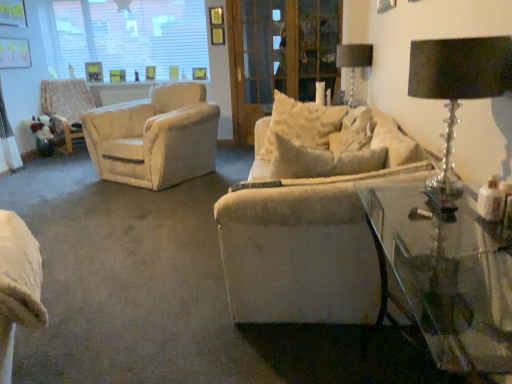
Question: Should I look upward or downward to see black crystal table lamp at upper right, the 1th table lamp from the front?

Choices:
 (A) up
 (B) down

Answer: (A)

Question: Could you tell me if transparent glass window at upper left is facing white textured chair at left?

Choices:
 (A) yes
 (B) no

Answer: (B)

Question: Is transparent glass window at upper left turned away from white textured chair at left?

Choices:
 (A) yes
 (B) no

Answer: (B)

Question: Is transparent glass window at upper left directly adjacent to white textured chair at left?

Choices:
 (A) yes
 (B) no

Answer: (B)

Question: Considering the relative sizes of transparent glass window at upper left and white textured chair at left in the image provided, is transparent glass window at upper left bigger than white textured chair at left?

Choices:
 (A) no
 (B) yes

Answer: (A)

Question: Does transparent glass window at upper left have a lesser height compared to white textured chair at left?

Choices:
 (A) no
 (B) yes

Answer: (A)

Question: From the image's perspective, is transparent glass window at upper left located beneath white textured chair at left?

Choices:
 (A) yes
 (B) no

Answer: (B)

Question: Is wooden screen door at center aimed at transparent glass window at upper left?

Choices:
 (A) yes
 (B) no

Answer: (B)

Question: From the image's perspective, is wooden screen door at center on top of transparent glass window at upper left?

Choices:
 (A) no
 (B) yes

Answer: (A)

Question: From the image's perspective, is wooden screen door at center under transparent glass window at upper left?

Choices:
 (A) no
 (B) yes

Answer: (B)

Question: Does wooden screen door at center lie behind transparent glass window at upper left?

Choices:
 (A) yes
 (B) no

Answer: (B)

Question: Is wooden screen door at center thinner than transparent glass window at upper left?

Choices:
 (A) no
 (B) yes

Answer: (A)

Question: Is wooden screen door at center wider than transparent glass window at upper left?

Choices:
 (A) yes
 (B) no

Answer: (A)

Question: Does transparent glass table at lower right appear on the right side of metallic glass table lamp at upper right, marked as the 1th table lamp in a top-to-bottom arrangement?

Choices:
 (A) yes
 (B) no

Answer: (B)